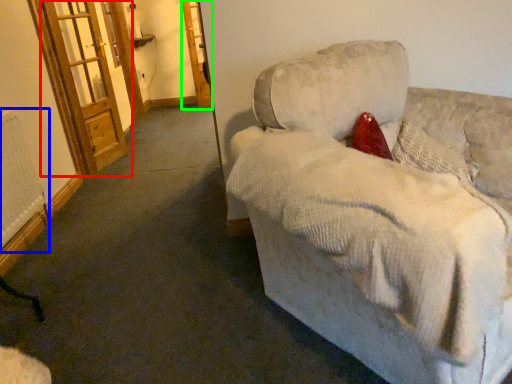
Question: Based on their relative distances, which object is nearer to screen door (highlighted by a red box)? Choose from radiator (highlighted by a blue box) and screen door (highlighted by a green box).

Choices:
 (A) radiator
 (B) screen door

Answer: (A)